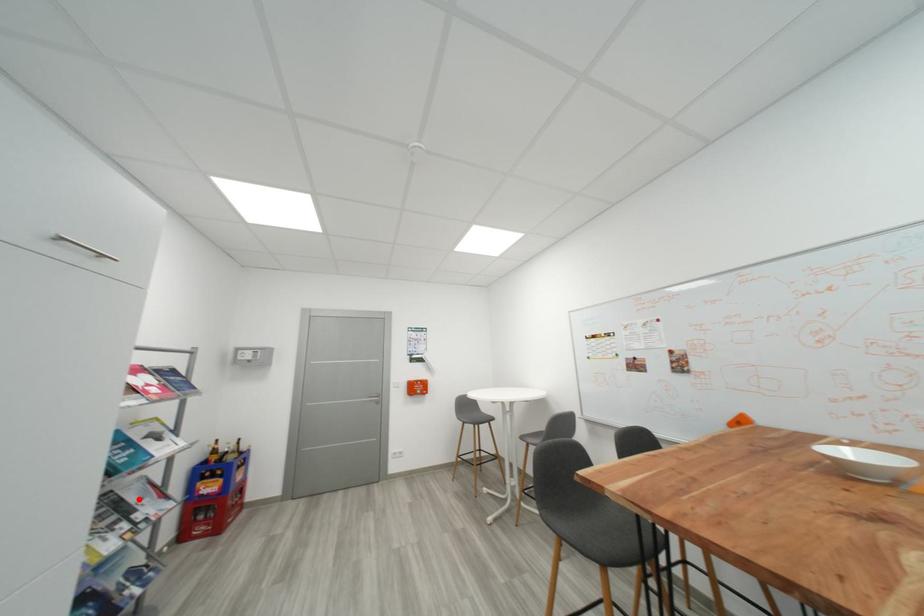
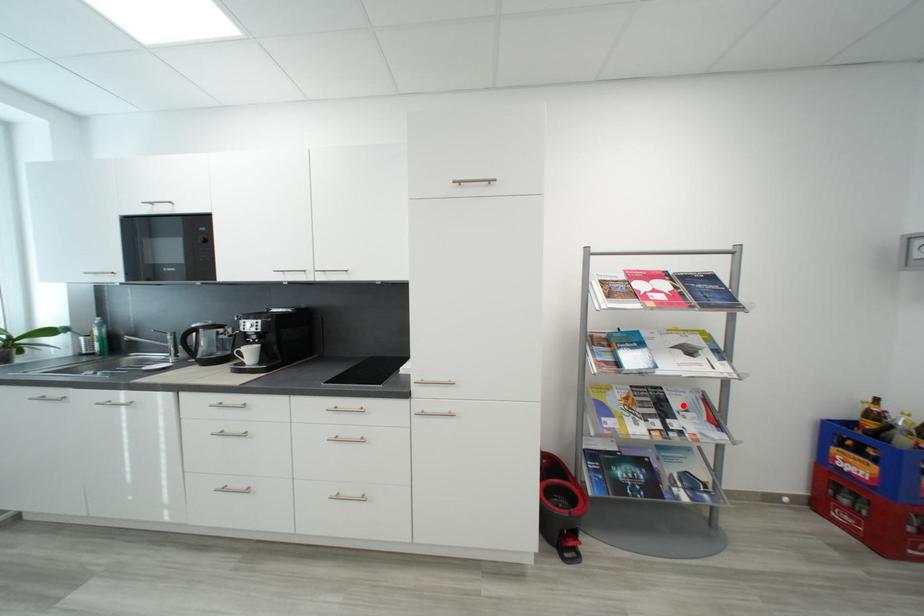
I am providing you with two images of the same scene from different viewpoints. A red point is marked on the first image and another point is marked on the second image. Are the points marked in image1 and image2 representing the same 3D position?

Yes